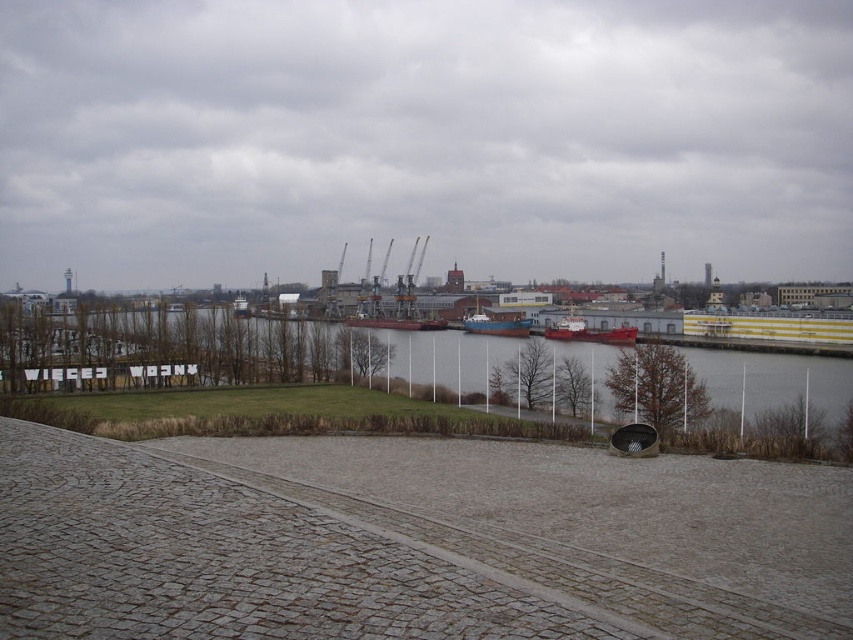
You are a delivery person needing to cross the gray concrete river at center to reach the blue matte boat at center. Can you walk directly from the river to the boat without stepping into the water?

The gray concrete river at center is wider than the blue matte boat at center, so you cannot walk directly from the river to the boat without stepping into the water.

You are a photographer planning to capture a landscape shot of the waterfront scene. You want to ensure that both the gray concrete river at center and the red matte ship at center are clearly visible in the frame. Based on their relative heights, which object will appear taller in the photograph?

The gray concrete river at center will appear taller in the photograph because it has a greater height compared to the red matte ship at center as stated in the description.

You are a photographer trying to capture a shot of the waterfront scene. You want to ensure that both the gray concrete river at center and the red matte ship at center are visible in your frame. Based on their positions, which object should you position closer to the left side of your camera viewfinder?

The gray concrete river at center is positioned on the left side of the red matte ship at center, so to include both in the frame, you should position the gray concrete river at center closer to the left side of your camera viewfinder.